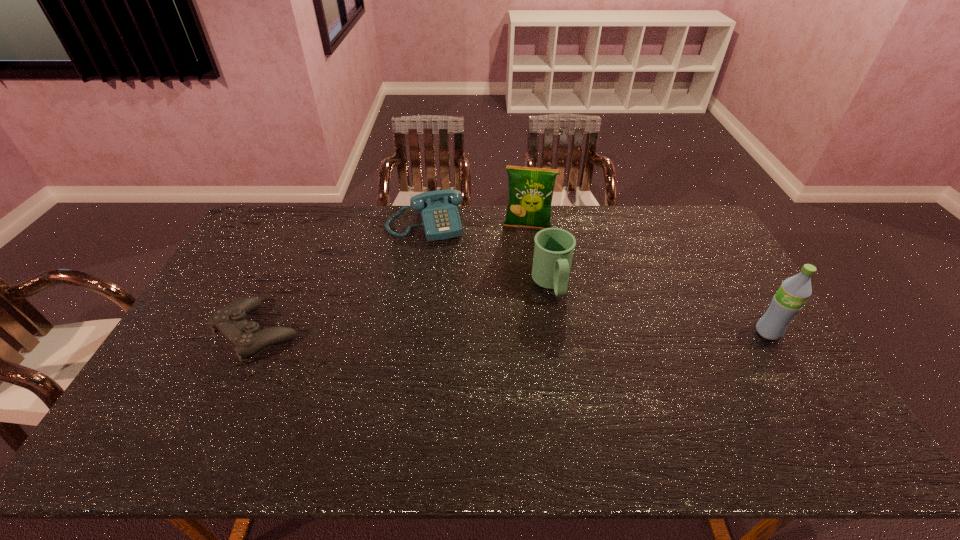
Locate an element on the screen. The width and height of the screenshot is (960, 540). the leftmost object is located at coordinates (246, 337).

Locate an element on the screen. The image size is (960, 540). the shortest object is located at coordinates (246, 337).

This screenshot has height=540, width=960. Find the location of `the rightmost object`. the rightmost object is located at coordinates (793, 293).

The width and height of the screenshot is (960, 540). Identify the location of crisp (potato chip). (531, 190).

Locate an element on the screen. the third tallest object is located at coordinates (x=553, y=251).

I want to click on the fourth tallest object, so click(x=440, y=218).

Where is `telephone`? Image resolution: width=960 pixels, height=540 pixels. telephone is located at coordinates (440, 218).

The image size is (960, 540). What are the coordinates of `free space located 0.100m on the back of the shortest object` in the screenshot? It's located at (283, 281).

Where is `free space located 0.250m on the left of the water bottle`? Image resolution: width=960 pixels, height=540 pixels. free space located 0.250m on the left of the water bottle is located at coordinates (670, 332).

Locate an element on the screen. vacant space located 0.220m on the front-facing side of the crisp (potato chip) is located at coordinates (519, 273).